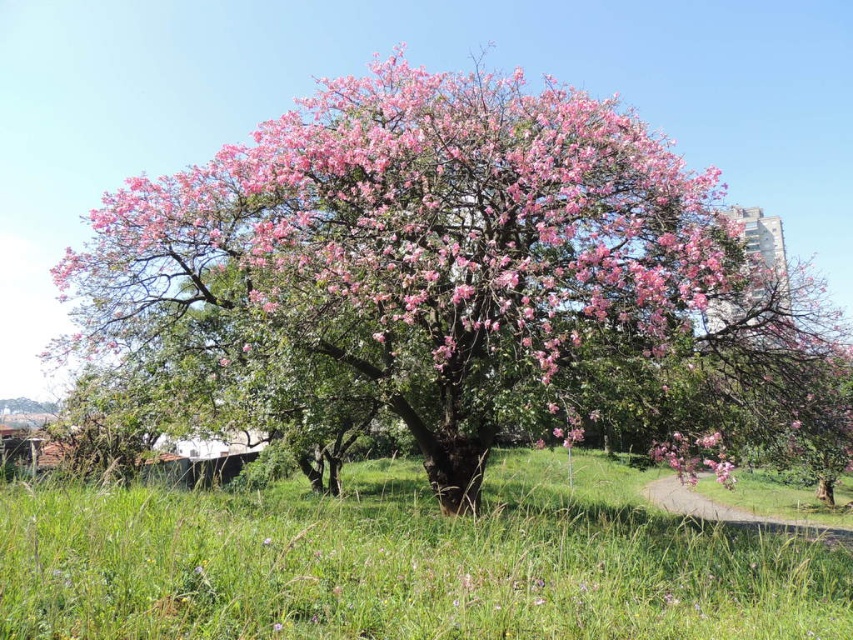
Question: Which object appears farthest from the camera in this image?

Choices:
 (A) green grass at center
 (B) pink blossoming tree at center

Answer: (B)

Question: Does pink blossoming tree at center appear on the left side of green grass at center?

Choices:
 (A) no
 (B) yes

Answer: (A)

Question: Can you confirm if pink blossoming tree at center is positioned to the left of green grass at center?

Choices:
 (A) no
 (B) yes

Answer: (A)

Question: Does pink blossoming tree at center appear on the left side of green grass at center?

Choices:
 (A) no
 (B) yes

Answer: (A)